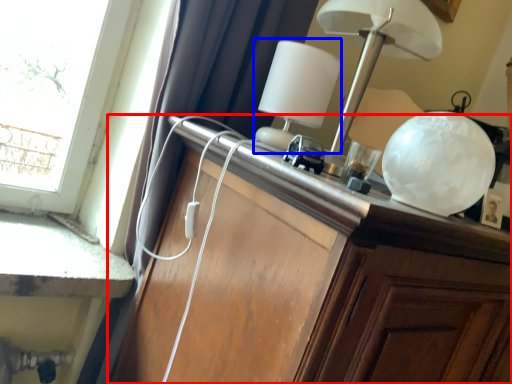
Question: Which object is closer to the camera taking this photo, cabinetry (highlighted by a red box) or table lamp (highlighted by a blue box)?

Choices:
 (A) cabinetry
 (B) table lamp

Answer: (A)